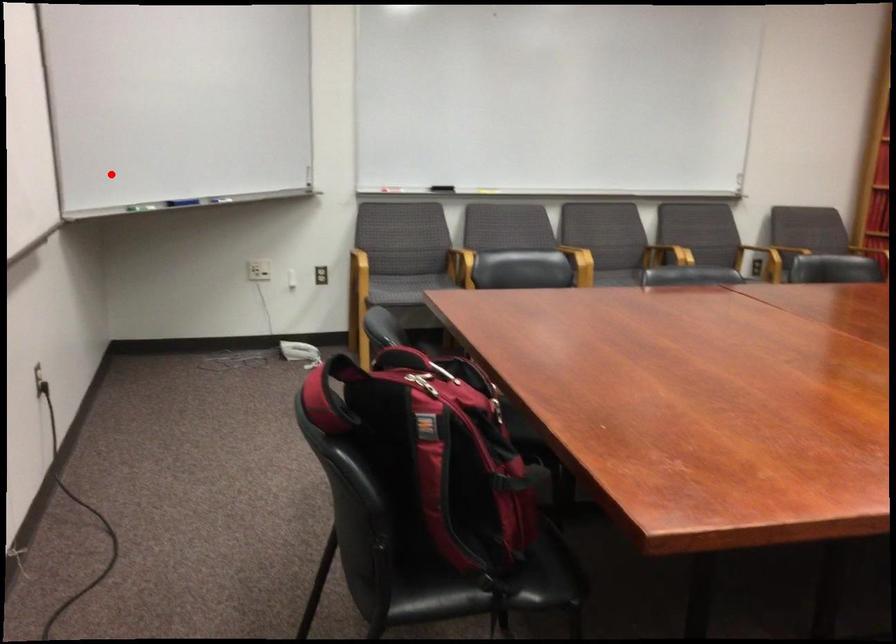
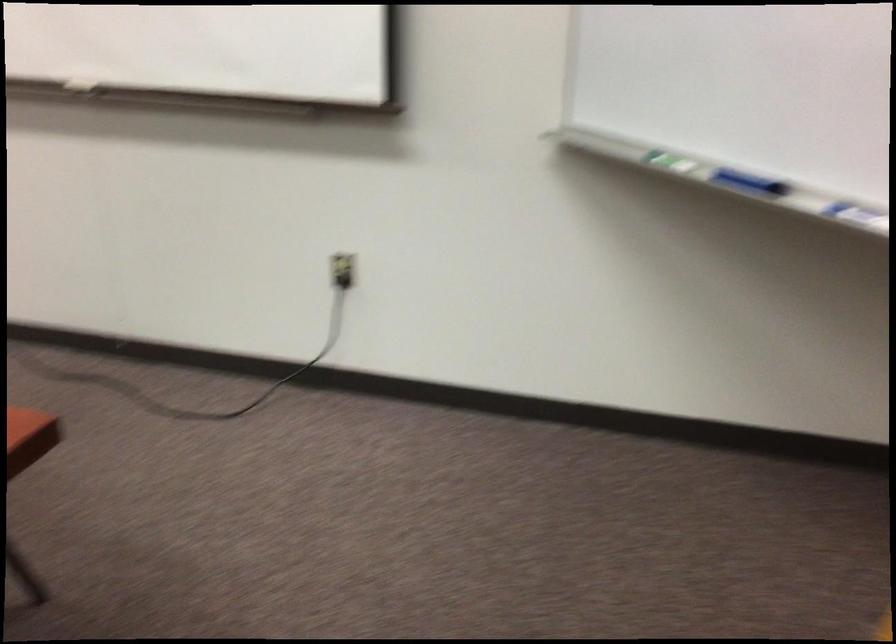
Question: I am providing you with two images of the same scene from different viewpoints. Image1 has a red point marked. In image2, the corresponding 3D location appears at what relative position? Reply with the corresponding letter.

Choices:
 (A) Closer
 (B) Farther

Answer: (A)